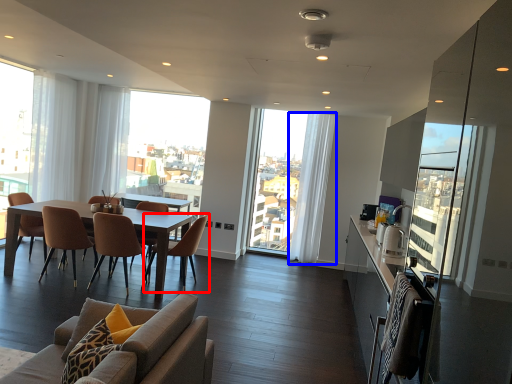
Question: Among these objects, which one is nearest to the camera, chair (highlighted by a red box) or curtain (highlighted by a blue box)?

Choices:
 (A) chair
 (B) curtain

Answer: (A)